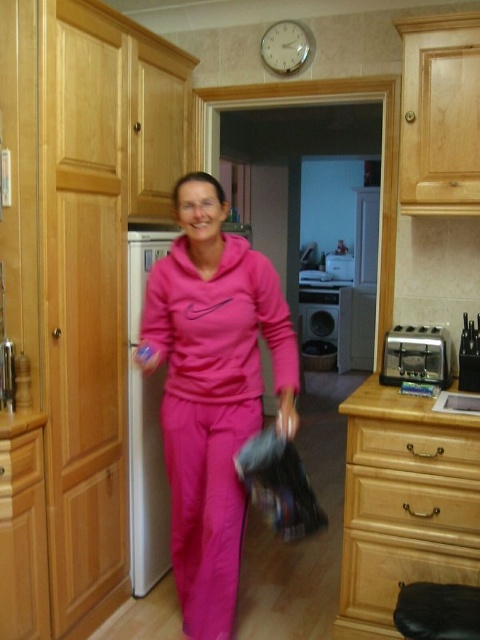
Does light wood drawer at lower right appear under wooden drawer at lower left?

No, light wood drawer at lower right is not below wooden drawer at lower left.

Does light wood drawer at lower right have a greater width compared to wooden drawer at lower left?

Indeed, light wood drawer at lower right has a greater width compared to wooden drawer at lower left.

Is point (363, 433) less distant than point (36, 456)?

No, (363, 433) is further to viewer.

Image resolution: width=480 pixels, height=640 pixels. In order to click on light wood drawer at lower right in this screenshot , I will do `click(412, 448)`.

Which is in front, point (360, 452) or point (335, 317)?

Positioned in front is point (360, 452).

Identify the location of light wood drawer at lower right. The width and height of the screenshot is (480, 640). (412, 448).

Is pink fleece tracksuit at center above light wood drawer at lower right?

Yes, pink fleece tracksuit at center is above light wood drawer at lower right.

Can you confirm if pink fleece tracksuit at center is positioned below light wood drawer at lower right?

No, pink fleece tracksuit at center is not below light wood drawer at lower right.

You are a GUI agent. You are given a task and a screenshot of the screen. Output one action in this format:
    pyautogui.click(x=<x>, y=<y>)
    Task: Click on the pink fleece tracksuit at center
    Image resolution: width=480 pixels, height=640 pixels.
    Given the screenshot: What is the action you would take?
    pyautogui.click(x=212, y=390)